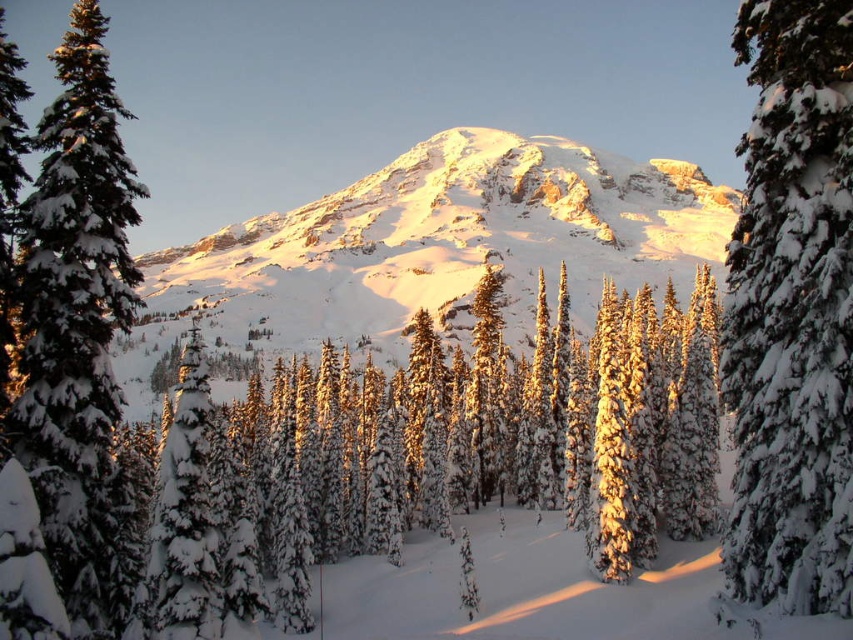
Does snow-covered pine at center appear on the right side of snow-covered evergreen at center?

Yes, snow-covered pine at center is to the right of snow-covered evergreen at center.

Is point (619, 452) positioned behind point (88, 280)?

Yes, point (619, 452) is behind point (88, 280).

This screenshot has height=640, width=853. I want to click on snow-covered pine at center, so click(x=482, y=438).

Does white snow-covered mountain at center have a lesser width compared to snow-covered evergreen at center?

Incorrect, white snow-covered mountain at center's width is not less than snow-covered evergreen at center's.

Describe the element at coordinates (434, 246) in the screenshot. This screenshot has width=853, height=640. I see `white snow-covered mountain at center` at that location.

Is point (244, 308) positioned before point (47, 317)?

No, (244, 308) is further to viewer.

Locate an element on the screen. The width and height of the screenshot is (853, 640). white snow-covered mountain at center is located at coordinates (434, 246).

Between white snow-covered mountain at center and snow-covered evergreen at right, which one appears on the left side from the viewer's perspective?

white snow-covered mountain at center

Who is more distant from viewer, (260, 348) or (840, 461)?

The point (260, 348) is behind.

In order to click on white snow-covered mountain at center in this screenshot , I will do `click(434, 246)`.